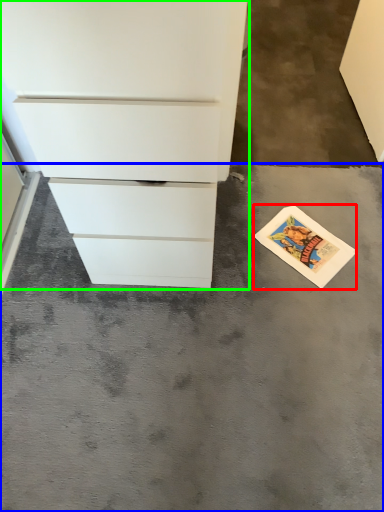
Question: Which object is the farthest from postcard (highlighted by a red box)? Choose among these: concrete (highlighted by a blue box) or chest of drawers (highlighted by a green box).

Choices:
 (A) concrete
 (B) chest of drawers

Answer: (B)